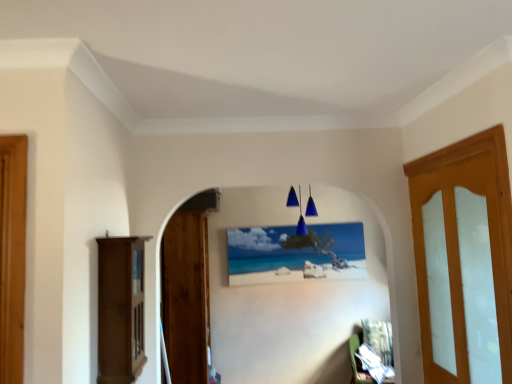
Question: Considering their positions, is matte canvas painting at center located in front of or behind light brown wooden door at right, arranged as the 2th door when viewed from the left?

Choices:
 (A) behind
 (B) front

Answer: (A)

Question: Choose the correct answer: Is matte canvas painting at center inside light brown wooden door at right, the 1th door in the front-to-back sequence, or outside it?

Choices:
 (A) outside
 (B) inside

Answer: (A)

Question: Which is farther from the denim fabric chair at lower right, the second furniture when ordered from left to right?

Choices:
 (A) wooden door at left, which is the 1th door in back-to-front order
 (B) matte wood cabinet at left, positioned as the 2th furniture in right-to-left order
 (C) matte canvas painting at center
 (D) blue glass pendant lights at center
 (E) light brown wooden door at right, arranged as the 2th door when viewed from the left

Answer: (B)

Question: Estimate the real-world distances between objects in this image. Which object is closer to the blue glass pendant lights at center?

Choices:
 (A) wooden door at left, which is the 1th door in back-to-front order
 (B) light brown wooden door at right, arranged as the 2th door when viewed from the left
 (C) matte canvas painting at center
 (D) matte wood cabinet at left, arranged as the first furniture when viewed from the front
 (E) denim fabric chair at lower right, the 1th furniture viewed from the back

Answer: (C)